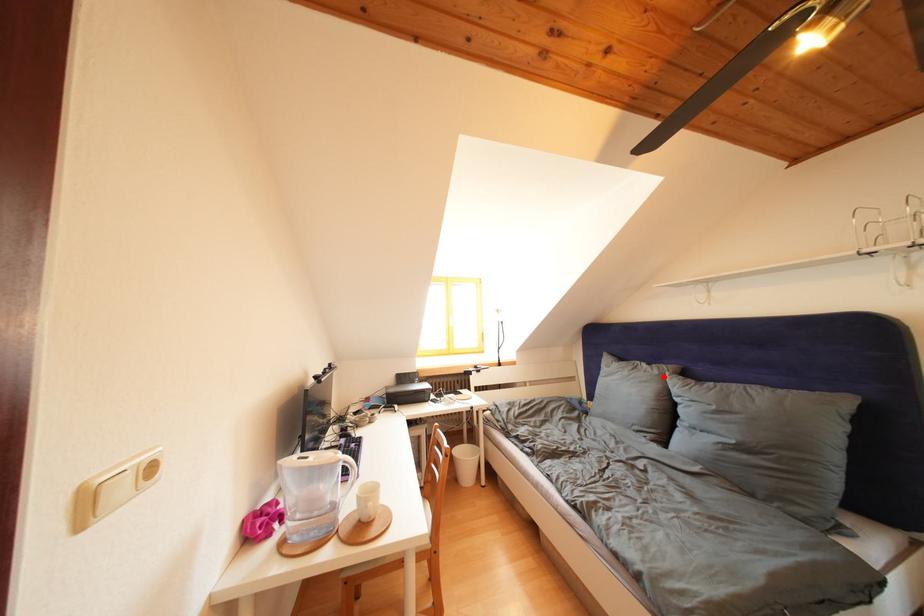
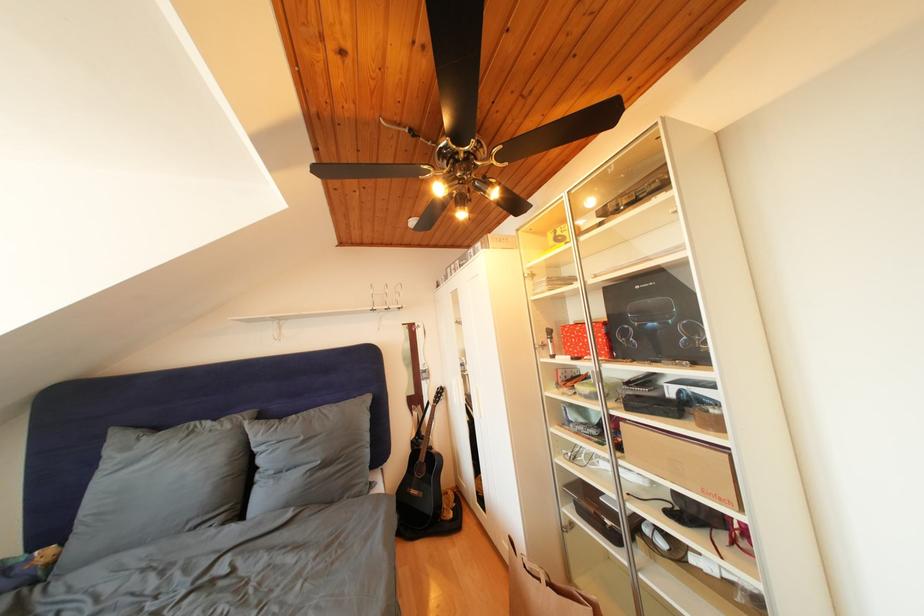
Locate, in the second image, the point that corresponds to the highlighted location in the first image.

(236, 432)